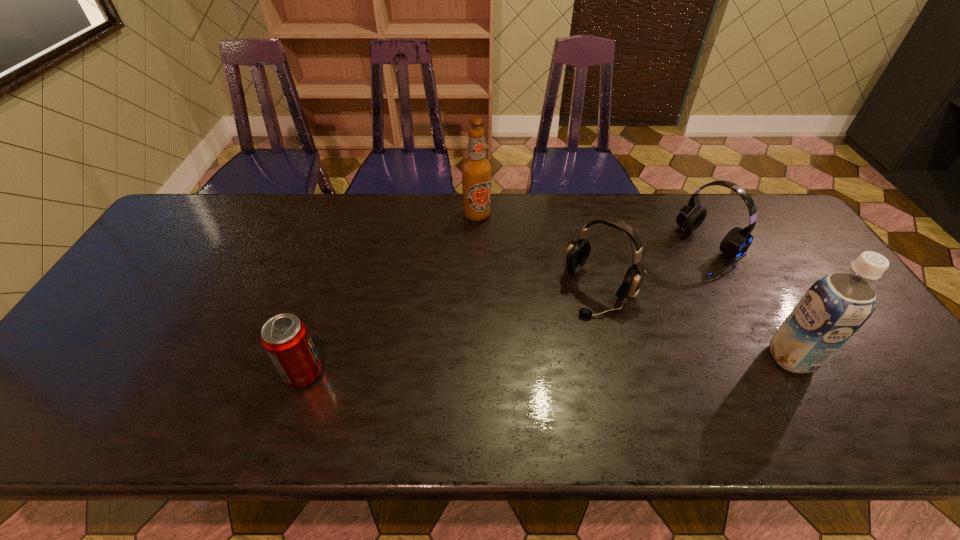
In order to click on beer bottle that is at the far edge in this screenshot , I will do `click(476, 170)`.

Locate an element on the screen. soda can present at the near edge is located at coordinates (285, 337).

What are the coordinates of `soya milk present at the near edge` in the screenshot? It's located at (837, 305).

At what (x,y) coordinates should I click in order to perform the action: click on vacant space at the far edge of the desktop. Please return your answer as a coordinate pair (x, y). This screenshot has width=960, height=540. Looking at the image, I should click on (444, 218).

The image size is (960, 540). What are the coordinates of `vacant space at the near edge of the desktop` in the screenshot? It's located at (600, 380).

In the image, there is a desktop. Where is `vacant space at the left edge`? vacant space at the left edge is located at coordinates (162, 287).

Find the location of `free space at the right edge`. free space at the right edge is located at coordinates (804, 272).

The image size is (960, 540). I want to click on free space at the far left corner of the desktop, so click(x=179, y=233).

Locate an element on the screen. The width and height of the screenshot is (960, 540). vacant space at the far right corner of the desktop is located at coordinates (758, 212).

The height and width of the screenshot is (540, 960). Find the location of `vacant area at the near right corner`. vacant area at the near right corner is located at coordinates (849, 365).